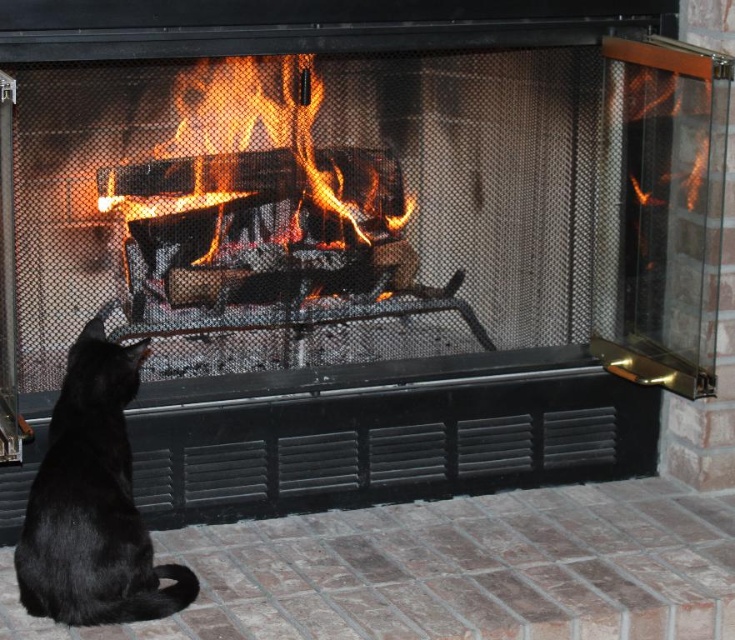
Question: Can you confirm if black fur cat at lower left is smaller than charcoal wood fire at center?

Choices:
 (A) yes
 (B) no

Answer: (A)

Question: Is black fur cat at lower left further to the viewer compared to charcoal wood fire at center?

Choices:
 (A) yes
 (B) no

Answer: (B)

Question: From the image, what is the correct spatial relationship of black fur cat at lower left in relation to charcoal wood fire at center?

Choices:
 (A) above
 (B) below

Answer: (B)

Question: Which point is closer to the camera?

Choices:
 (A) (62, 480)
 (B) (376, 182)

Answer: (A)

Question: Which point is farther to the camera?

Choices:
 (A) charcoal wood fire at center
 (B) black fur cat at lower left

Answer: (A)